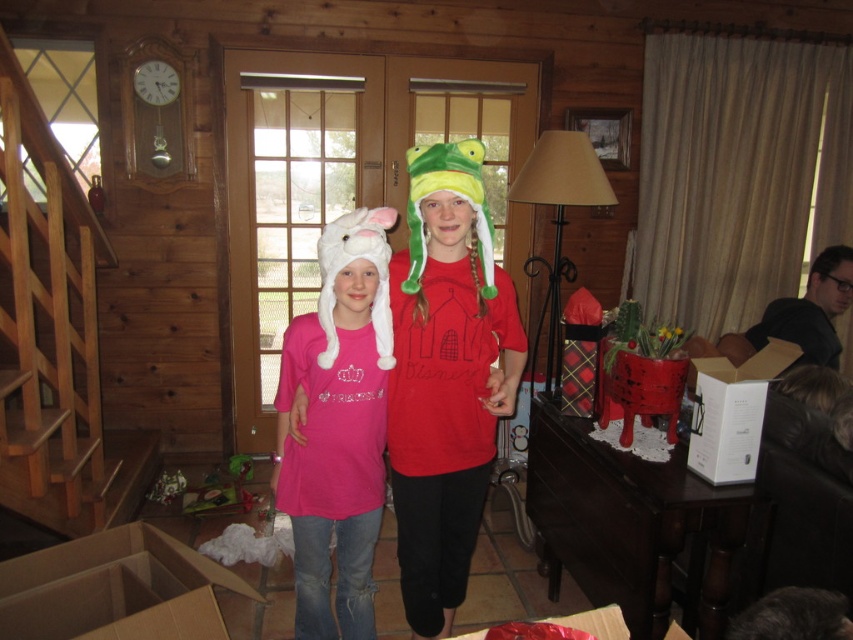
Between cardboard box at lower left and white fluffy hat at left, which one is positioned lower?

cardboard box at lower left is below.

Consider the image. Does cardboard box at lower left have a larger size compared to white fluffy hat at left?

Yes, cardboard box at lower left is bigger than white fluffy hat at left.

Does point (178, 614) come closer to viewer compared to point (334, 333)?

Yes.

I want to click on cardboard box at lower left, so click(115, 589).

Between white cardboard box at right and green fuzzy hat at center, which one is positioned higher?

Positioned higher is green fuzzy hat at center.

Between point (711, 408) and point (412, 192), which one is positioned behind?

The point (711, 408) is behind.

Who is more distant from viewer, (x=724, y=451) or (x=416, y=252)?

The point (x=724, y=451) is behind.

The width and height of the screenshot is (853, 640). I want to click on white cardboard box at right, so click(x=732, y=412).

Is matte green plush hat at center thinner than green fuzzy hat at center?

Incorrect, matte green plush hat at center's width is not less than green fuzzy hat at center's.

Does matte green plush hat at center appear under green fuzzy hat at center?

Correct, matte green plush hat at center is located below green fuzzy hat at center.

The width and height of the screenshot is (853, 640). What are the coordinates of `matte green plush hat at center` in the screenshot? It's located at (445, 378).